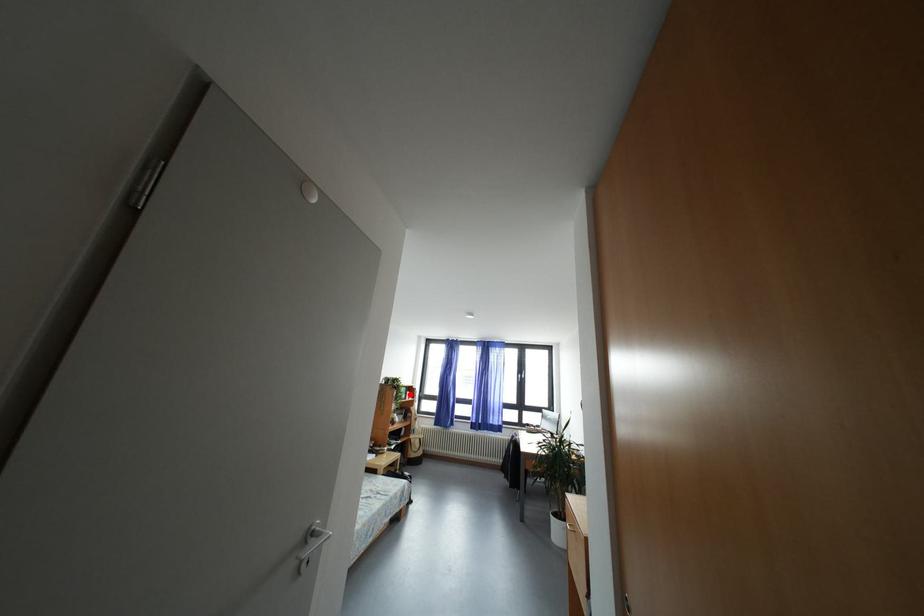
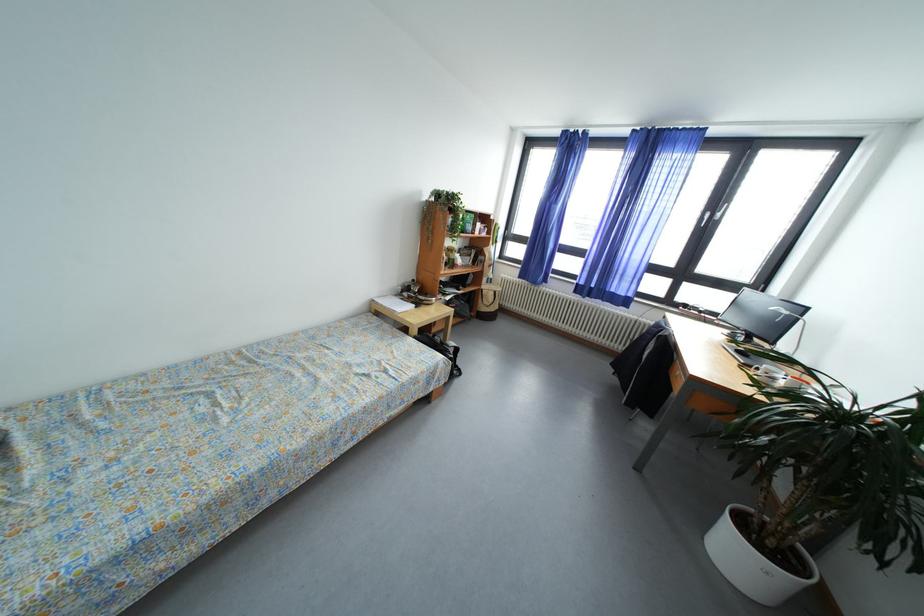
Question: A red point is marked in image1. In image2, is the corresponding 3D point closer to the camera or farther? Reply with the corresponding letter.

Choices:
 (A) The corresponding 3D point is closer.
 (B) The corresponding 3D point is farther.

Answer: (A)